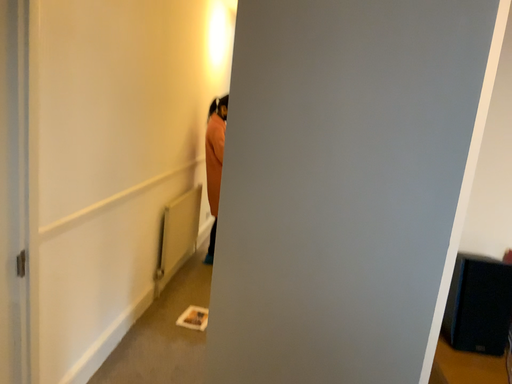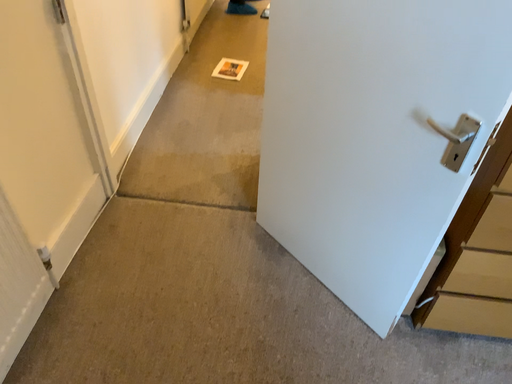
Question: Which way did the camera rotate in the video?

Choices:
 (A) rotated upward
 (B) rotated downward

Answer: (B)